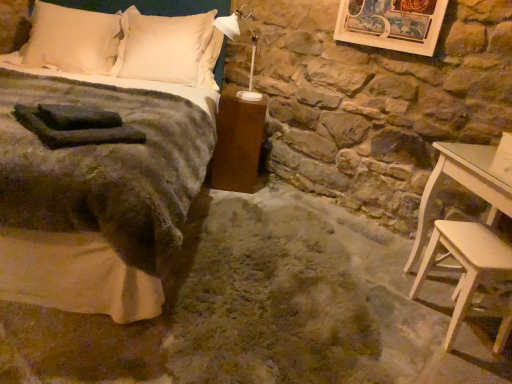
Question: Considering the relative sizes of light beige wood stool at lower right and satin white pillow at upper center, the 2th pillow in the left-to-right sequence, in the image provided, is light beige wood stool at lower right bigger than satin white pillow at upper center, the 2th pillow in the left-to-right sequence,?

Choices:
 (A) yes
 (B) no

Answer: (B)

Question: Is light beige wood stool at lower right facing away from satin white pillow at upper center, the 2th pillow in the left-to-right sequence?

Choices:
 (A) yes
 (B) no

Answer: (B)

Question: From a real-world perspective, is light beige wood stool at lower right physically below satin white pillow at upper center, the 2th pillow in the left-to-right sequence?

Choices:
 (A) no
 (B) yes

Answer: (B)

Question: Can you confirm if light beige wood stool at lower right is smaller than satin white pillow at upper center, the 2th pillow in the left-to-right sequence?

Choices:
 (A) yes
 (B) no

Answer: (A)

Question: Is light beige wood stool at lower right far away from satin white pillow at upper center, the 2th pillow in the left-to-right sequence?

Choices:
 (A) yes
 (B) no

Answer: (A)

Question: From a real-world perspective, is white soft pillow at upper left, arranged as the 2th pillow when viewed from the right, physically located above or below velvet green blanket at left?

Choices:
 (A) below
 (B) above

Answer: (B)

Question: From the image's perspective, is white soft pillow at upper left, arranged as the 2th pillow when viewed from the right, positioned above or below velvet green blanket at left?

Choices:
 (A) below
 (B) above

Answer: (B)

Question: Considering their positions, is white soft pillow at upper left, arranged as the 2th pillow when viewed from the right, located in front of or behind velvet green blanket at left?

Choices:
 (A) front
 (B) behind

Answer: (B)

Question: Choose the correct answer: Is white soft pillow at upper left, which is counted as the 1th pillow, starting from the left, inside velvet green blanket at left or outside it?

Choices:
 (A) inside
 (B) outside

Answer: (A)

Question: From the image's perspective, is satin white pillow at upper center, the 2th pillow in the left-to-right sequence, located above or below white soft pillow at upper left, arranged as the 2th pillow when viewed from the right?

Choices:
 (A) above
 (B) below

Answer: (B)

Question: From their relative heights in the image, would you say satin white pillow at upper center, the 2th pillow in the left-to-right sequence, is taller or shorter than white soft pillow at upper left, arranged as the 2th pillow when viewed from the right?

Choices:
 (A) short
 (B) tall

Answer: (B)

Question: Considering the positions of satin white pillow at upper center, the 2th pillow in the left-to-right sequence, and white soft pillow at upper left, which is counted as the 1th pillow, starting from the left, in the image, is satin white pillow at upper center, the 2th pillow in the left-to-right sequence, bigger or smaller than white soft pillow at upper left, which is counted as the 1th pillow, starting from the left,?

Choices:
 (A) big
 (B) small

Answer: (A)

Question: Choose the correct answer: Is satin white pillow at upper center, the 2th pillow in the left-to-right sequence, inside white soft pillow at upper left, arranged as the 2th pillow when viewed from the right, or outside it?

Choices:
 (A) inside
 (B) outside

Answer: (B)

Question: From the image's perspective, is velvet green blanket at left above or below light beige wood stool at lower right?

Choices:
 (A) above
 (B) below

Answer: (A)

Question: Does point (120, 190) appear closer or farther from the camera than point (431, 238)?

Choices:
 (A) closer
 (B) farther

Answer: (A)